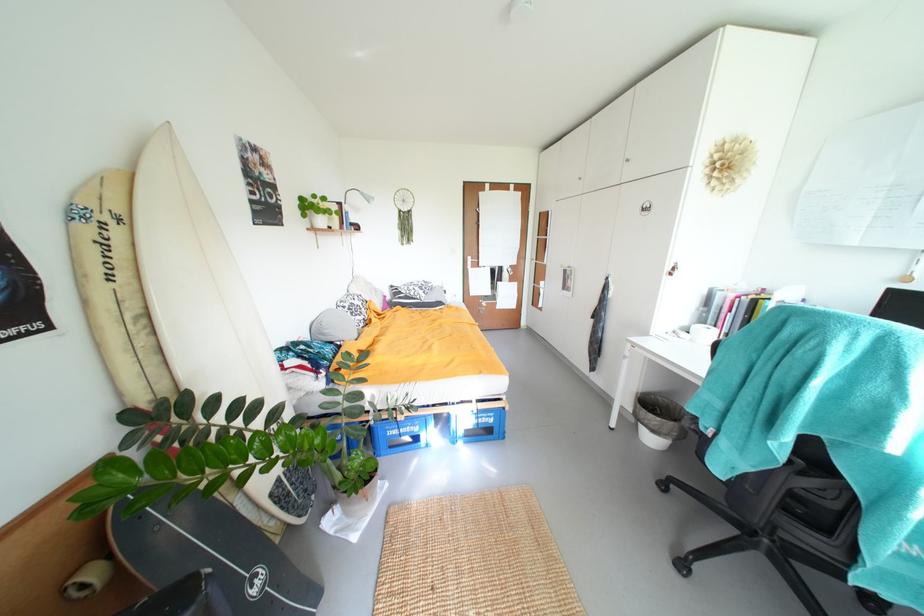
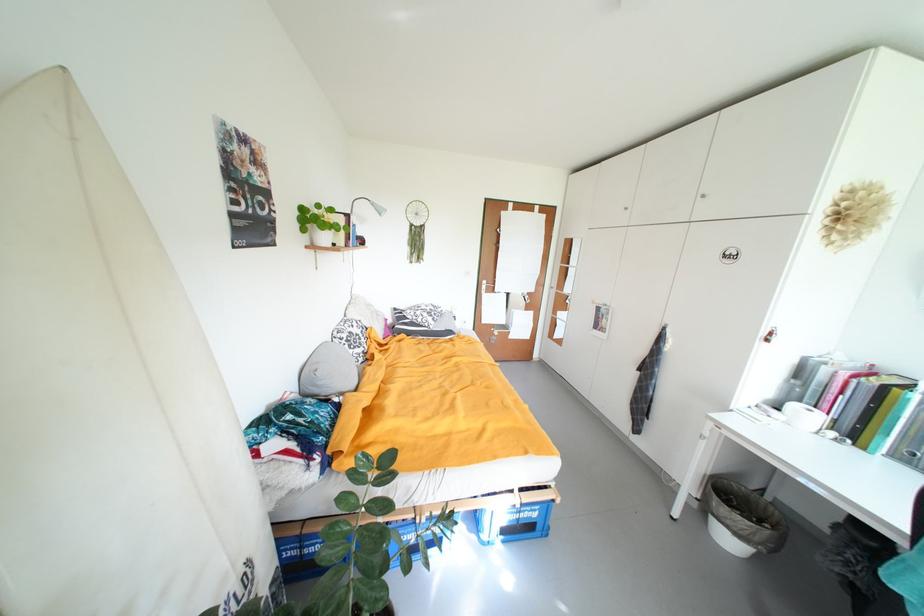
The point at (499, 422) is marked in the first image. Where is the corresponding point in the second image?

(543, 517)